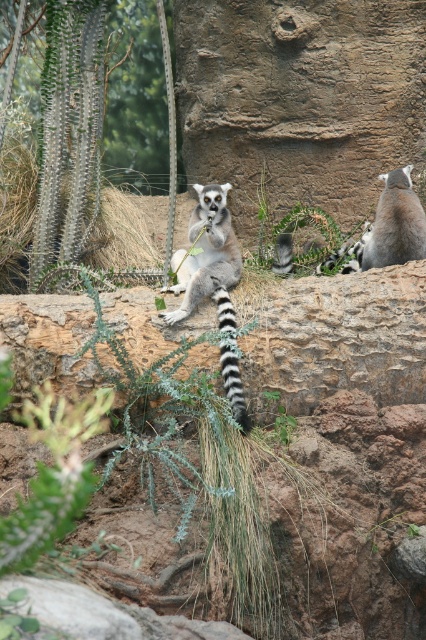
Is point (126, 1) more distant than point (388, 230)?

Yes, point (126, 1) is behind point (388, 230).

Based on the photo, does green spiky cactus at upper left appear on the right side of ring-tailed lemur at upper right?

No, green spiky cactus at upper left is not to the right of ring-tailed lemur at upper right.

Identify the location of green spiky cactus at upper left. (135, 100).

Is ring-tailed lemur at center further to the viewer compared to ring-tailed lemur at upper right?

No, ring-tailed lemur at center is closer to the viewer.

Which is below, ring-tailed lemur at center or ring-tailed lemur at upper right?

ring-tailed lemur at center is below.

Does point (187, 260) come in front of point (414, 253)?

That is True.

You are a GUI agent. You are given a task and a screenshot of the screen. Output one action in this format:
    pyautogui.click(x=<x>, y=<y>)
    Task: Click on the ring-tailed lemur at center
    The width and height of the screenshot is (426, 640).
    Given the screenshot: What is the action you would take?
    pyautogui.click(x=207, y=259)

Who is positioned more to the left, green spiky cactus at upper left or ring-tailed lemur at center?

green spiky cactus at upper left is more to the left.

Image resolution: width=426 pixels, height=640 pixels. What do you see at coordinates (135, 100) in the screenshot? I see `green spiky cactus at upper left` at bounding box center [135, 100].

Does point (135, 42) lie in front of point (219, 189)?

No, it is behind (219, 189).

Locate an element on the screen. The width and height of the screenshot is (426, 640). green spiky cactus at upper left is located at coordinates (135, 100).